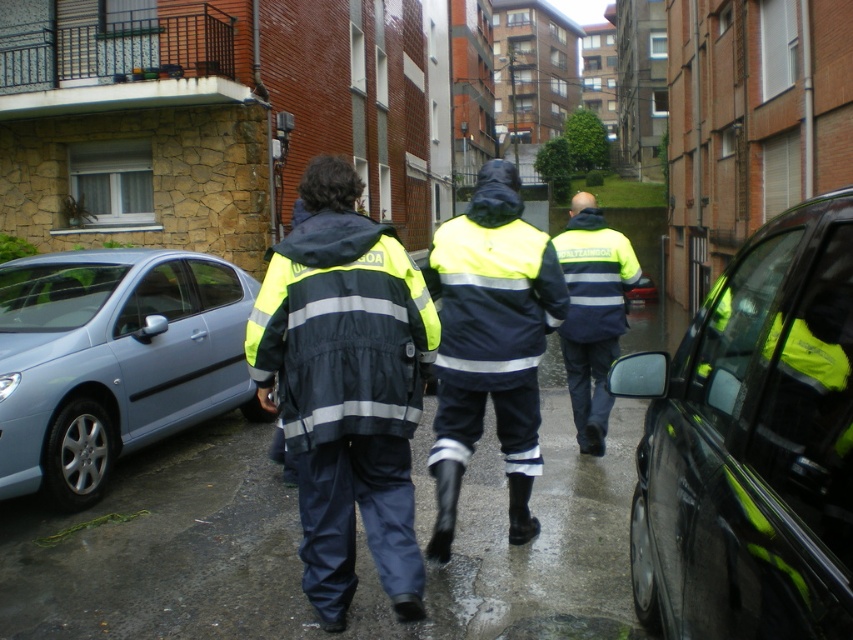
Question: Does high-visibility reflective jacket at center have a larger size compared to high visibility yellow jacket at center?

Choices:
 (A) no
 (B) yes

Answer: (B)

Question: Is reflective yellow jacket at center thinner than high-visibility reflective jacket at center?

Choices:
 (A) yes
 (B) no

Answer: (B)

Question: Which point is closer to the camera?

Choices:
 (A) reflective yellow jacket at center
 (B) light blue metallic car at left
 (C) shiny black car at right

Answer: (C)

Question: Does light blue metallic car at left appear over high-visibility reflective jacket at center?

Choices:
 (A) yes
 (B) no

Answer: (B)

Question: Estimate the real-world distances between objects in this image. Which object is farther from the high visibility yellow jacket at center?

Choices:
 (A) reflective yellow jacket at center
 (B) light blue metallic car at left
 (C) high-visibility reflective jacket at center
 (D) shiny black car at right

Answer: (D)

Question: Which is farther from the shiny black car at right?

Choices:
 (A) light blue metallic car at left
 (B) reflective yellow jacket at center
 (C) high-visibility reflective jacket at center
 (D) high visibility yellow jacket at center

Answer: (A)